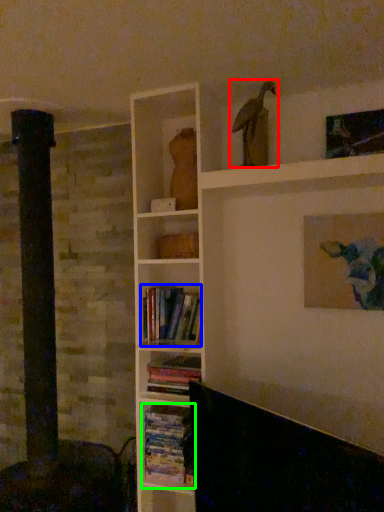
Question: Which object is positioned farthest from bird (highlighted by a red box)? Select from book (highlighted by a blue box) and book (highlighted by a green box).

Choices:
 (A) book
 (B) book

Answer: (B)